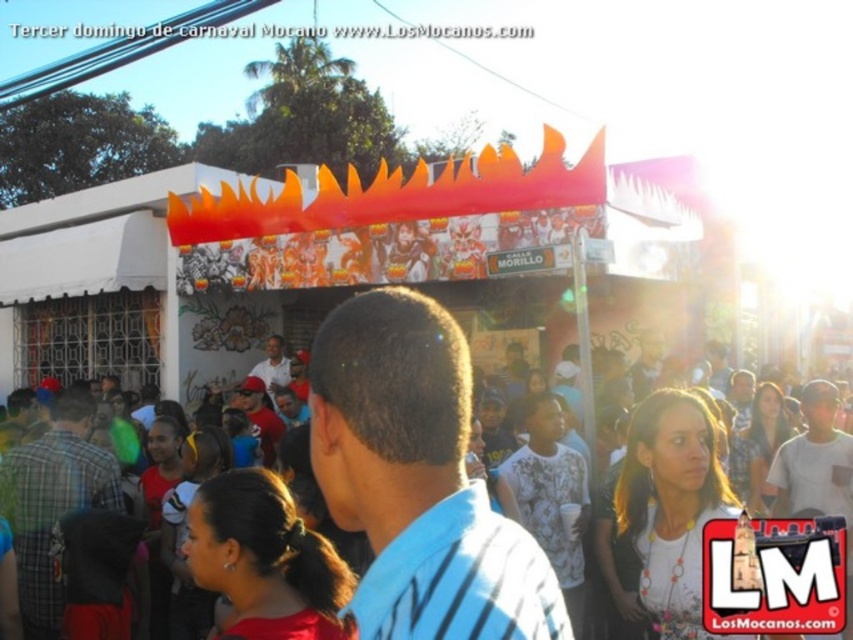
You are a photographer at the carnival and want to capture both the blue striped shirt at center and the white matte shirt at center in your photo. However, you can only focus on one person at a time. Which shirt should you focus on to ensure the other is still visible in the background?

You should focus on the blue striped shirt at center because it is in front of the white matte shirt at center, so the white matte shirt at center will be visible in the background.

From the picture: You are a photographer at the carnival and want to capture both the matte black crowd at center and the blue striped shirt at center in a single shot. Which object will appear larger in the photo?

The matte black crowd at center will appear larger in the photo because it is larger in size than the blue striped shirt at center.

Based on the scene description, where is the matte black crowd at center located in terms of coordinates?

The matte black crowd at center is located at coordinates point [416,480].